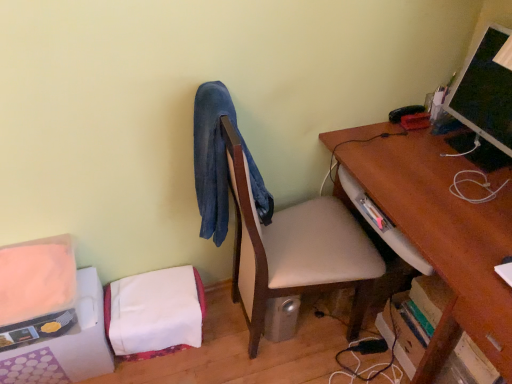
Image resolution: width=512 pixels, height=384 pixels. Identify the location of vacant space underneath matte black monitor at upper right (from a real-world perspective). (490, 157).